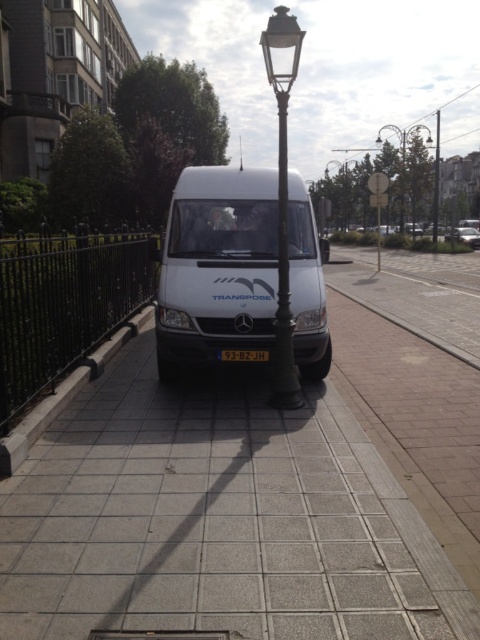
Question: Estimate the real-world distances between objects in this image. Which object is farther from the metallic silver van at center?

Choices:
 (A) metallic streetlight at upper center
 (B) black plastic license plate at center
 (C) dark bronze streetlamp at center

Answer: (B)

Question: Is white matte van at center above black plastic license plate at center?

Choices:
 (A) yes
 (B) no

Answer: (A)

Question: Which of the following is the closest to the observer?

Choices:
 (A) (61, 401)
 (B) (160, 348)
 (C) (83, 440)

Answer: (C)

Question: Which object is farther from the camera taking this photo?

Choices:
 (A) gray concrete pavement at center
 (B) metallic silver van at center
 (C) metallic streetlight at upper center

Answer: (C)

Question: Does dark bronze streetlamp at center have a larger size compared to black plastic license plate at center?

Choices:
 (A) yes
 (B) no

Answer: (A)

Question: Does gray concrete pavement at center appear on the left side of white matte van at center?

Choices:
 (A) yes
 (B) no

Answer: (A)